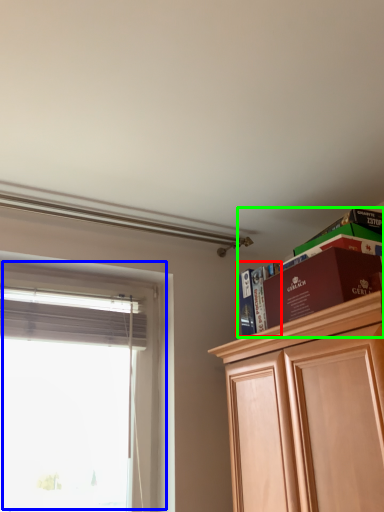
Question: Estimate the real-world distances between objects in this image. Which object is closer to book (highlighted by a red box), window (highlighted by a blue box) or shelf (highlighted by a green box)?

Choices:
 (A) window
 (B) shelf

Answer: (B)